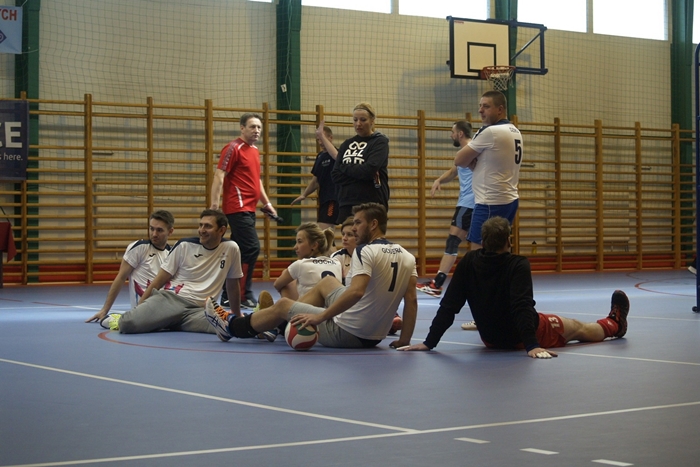
The width and height of the screenshot is (700, 467). Find the location of `wall`. wall is located at coordinates (168, 72).